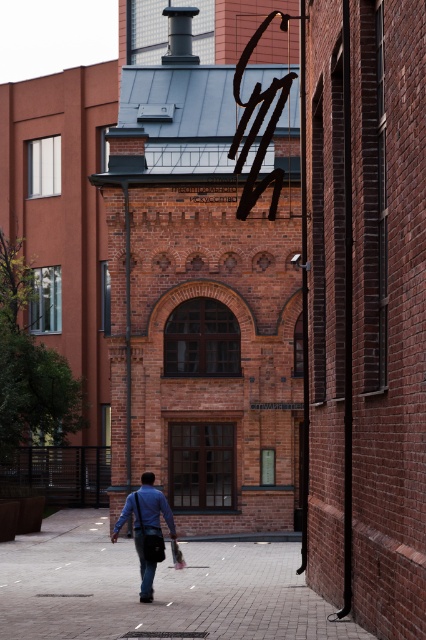
Question: Among these objects, which one is farthest from the camera?

Choices:
 (A) blue fabric bag at center
 (B) brick pavement at center

Answer: (A)

Question: From the image, what is the correct spatial relationship of brick pavement at center in relation to blue fabric bag at center?

Choices:
 (A) below
 (B) above

Answer: (A)

Question: Can you confirm if brick pavement at center is positioned above blue fabric bag at center?

Choices:
 (A) no
 (B) yes

Answer: (A)

Question: In this image, where is brick pavement at center located relative to blue fabric bag at center?

Choices:
 (A) right
 (B) left

Answer: (B)

Question: Which point appears farthest from the camera in this image?

Choices:
 (A) (169, 515)
 (B) (46, 572)

Answer: (B)